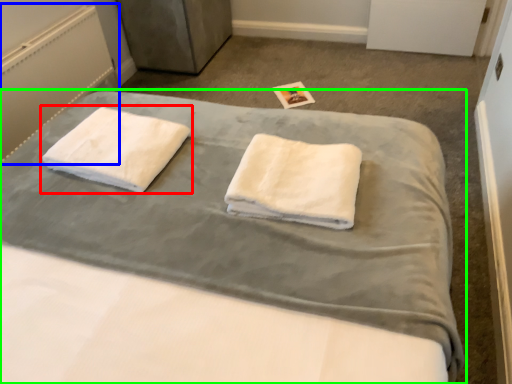
Question: Estimate the real-world distances between objects in this image. Which object is closer to towel (highlighted by a red box), radiator (highlighted by a blue box) or bed (highlighted by a green box)?

Choices:
 (A) radiator
 (B) bed

Answer: (B)